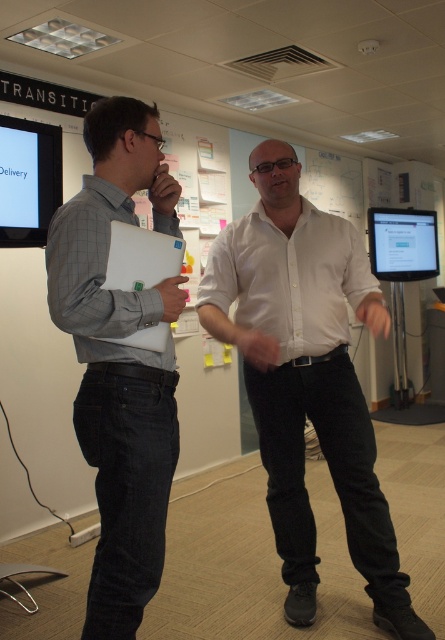
What do you see at coordinates (120, 360) in the screenshot? I see `gray matte shirt at left` at bounding box center [120, 360].

Is gray matte shirt at left positioned before white matte laptop at left?

Yes, gray matte shirt at left is closer to the viewer.

Between point (84, 406) and point (133, 333), which one is positioned in front?

Point (133, 333) is in front.

You are a GUI agent. You are given a task and a screenshot of the screen. Output one action in this format:
    pyautogui.click(x=<x>, y=<y>)
    Task: Click on the gray matte shirt at left
    The image size is (445, 640).
    Given the screenshot: What is the action you would take?
    pyautogui.click(x=120, y=360)

Does point (283, 292) lie in front of point (150, 240)?

No, (283, 292) is further to viewer.

Which is in front, point (379, 504) or point (106, 282)?

Point (106, 282) is more forward.

The width and height of the screenshot is (445, 640). I want to click on white glossy shirt at center, so click(307, 378).

Does white glossy shirt at center have a lesser width compared to gray matte shirt at left?

No, white glossy shirt at center is not thinner than gray matte shirt at left.

Is point (257, 376) positioned before point (146, 577)?

No.

Is point (377, 589) positioned behind point (118, 140)?

Yes, it is.

You are a GUI agent. You are given a task and a screenshot of the screen. Output one action in this format:
    pyautogui.click(x=<x>, y=<y>)
    Task: Click on the white glossy shirt at center
    
    Given the screenshot: What is the action you would take?
    pyautogui.click(x=307, y=378)